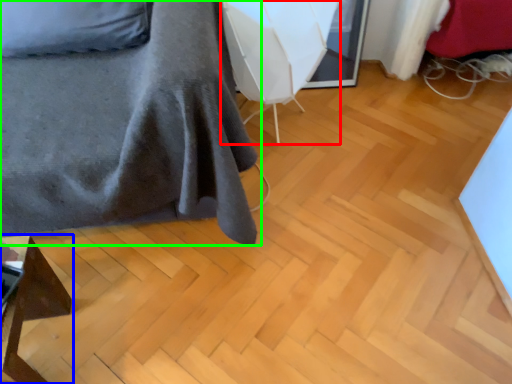
Question: Estimate the real-world distances between objects in this image. Which object is closer to swivel chair (highlighted by a red box), furniture (highlighted by a blue box) or furniture (highlighted by a green box)?

Choices:
 (A) furniture
 (B) furniture

Answer: (B)